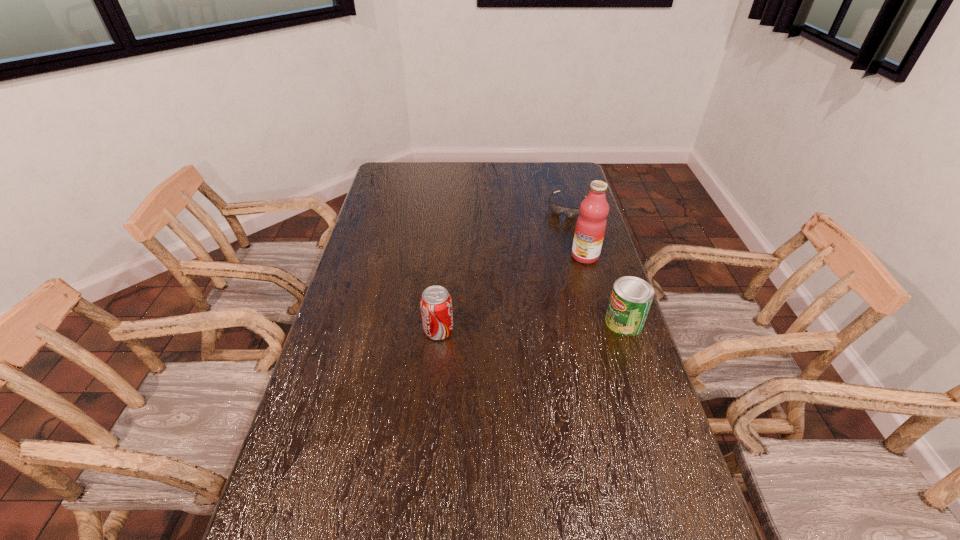
Where is `vacant space at the right edge of the desktop`? This screenshot has height=540, width=960. vacant space at the right edge of the desktop is located at coordinates (587, 272).

At what (x,y) coordinates should I click in order to perform the action: click on blank region between the third nearest object and the can. Please return your answer as a coordinate pair (x, y). Looking at the image, I should click on (605, 289).

Locate an element on the screen. The height and width of the screenshot is (540, 960). free space between the leftmost object and the third nearest object is located at coordinates (512, 294).

This screenshot has width=960, height=540. Find the location of `free space between the leftmost object and the can`. free space between the leftmost object and the can is located at coordinates (531, 327).

The height and width of the screenshot is (540, 960). Find the location of `vacant point located between the can and the soda`. vacant point located between the can and the soda is located at coordinates (531, 327).

Find the location of a particular element. This screenshot has height=540, width=960. blank region between the soda and the fruit juice is located at coordinates (512, 294).

The width and height of the screenshot is (960, 540). In order to click on vacant area between the third nearest object and the can in this screenshot , I will do `click(605, 289)`.

Find the location of `vacant area that lies between the soda and the goggles`. vacant area that lies between the soda and the goggles is located at coordinates (503, 269).

What are the coordinates of `vacant space in between the shortest object and the can` in the screenshot? It's located at (595, 265).

At what (x,y) coordinates should I click in order to perform the action: click on unoccupied position between the fruit juice and the leftmost object. Please return your answer as a coordinate pair (x, y). The image size is (960, 540). Looking at the image, I should click on pos(512,294).